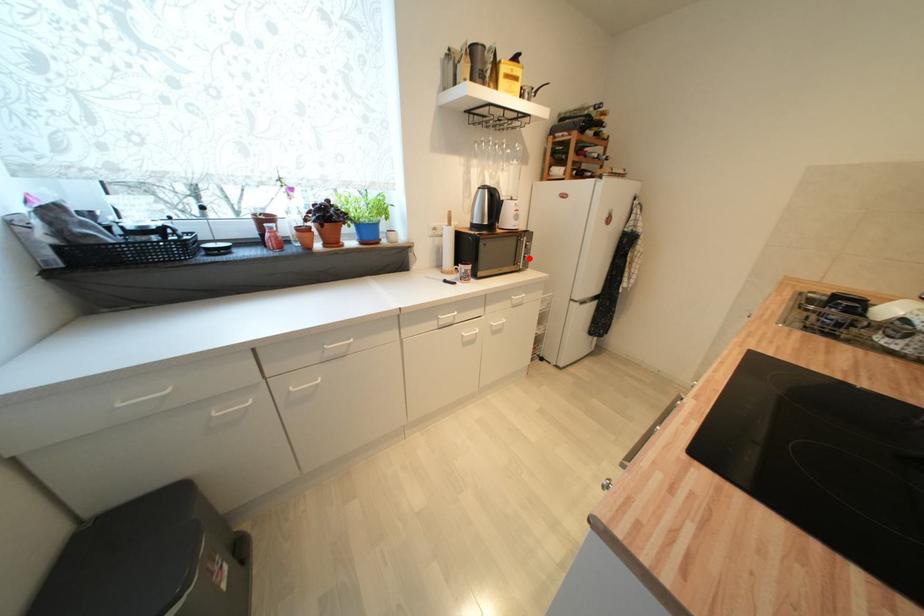
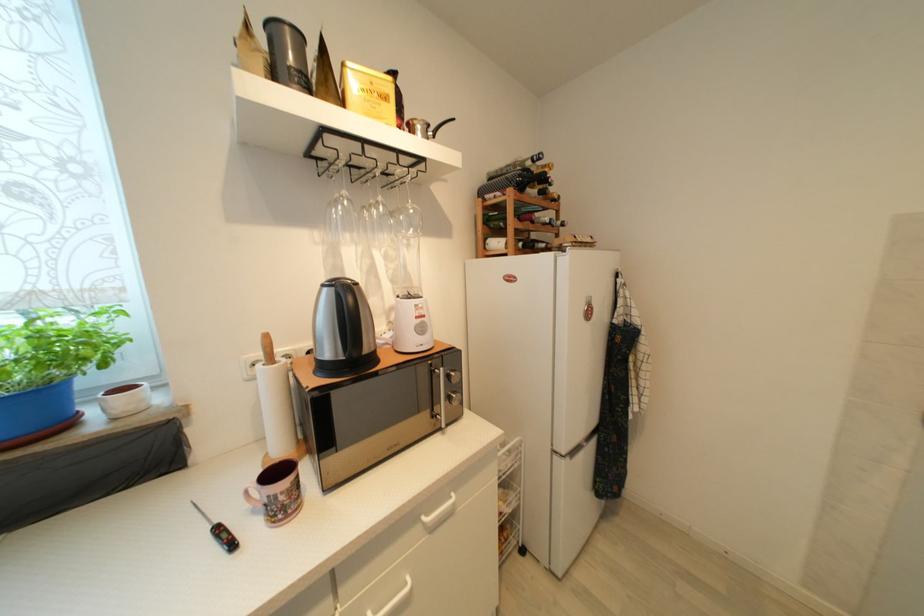
Locate, in the second image, the point that corresponds to the highlighted location in the first image.

(455, 400)